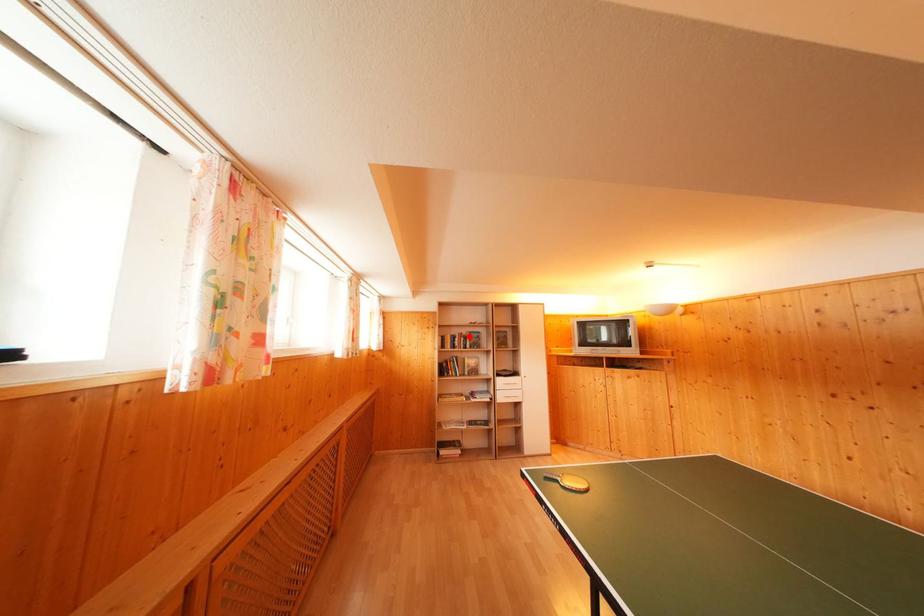
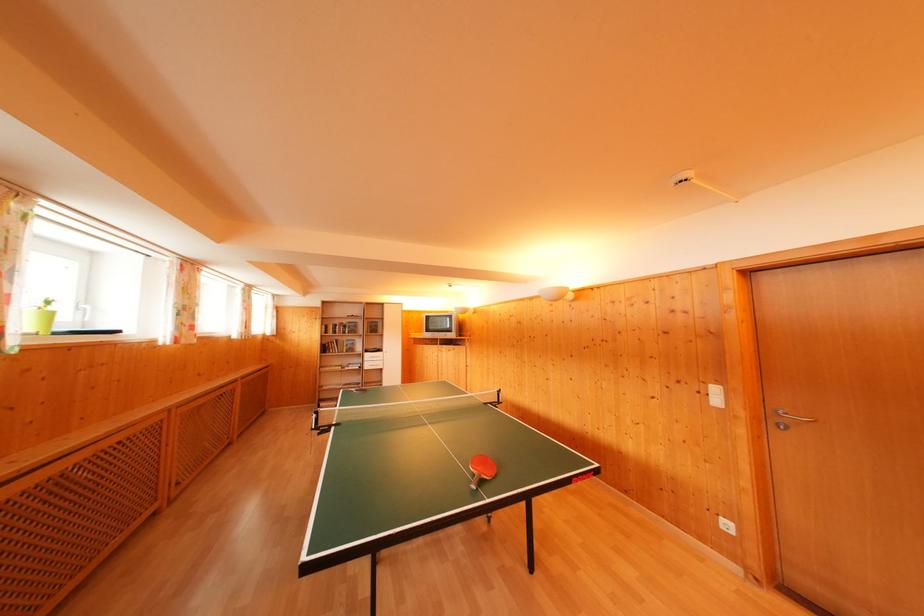
Where in the second image is the point corresponding to the highlighted location from the first image?

(349, 326)